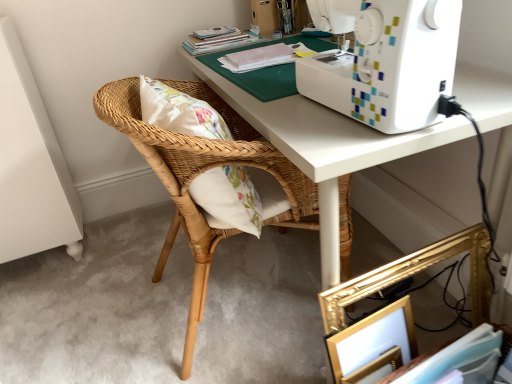
Where is `gold metallic picture frame at lower right`? Image resolution: width=512 pixels, height=384 pixels. gold metallic picture frame at lower right is located at coordinates (415, 273).

Measure the distance between point (247, 66) and camera.

They are 1.33 meters apart.

This screenshot has height=384, width=512. Describe the element at coordinates (259, 57) in the screenshot. I see `matte white book at upper center, which appears as the 2th book when viewed from the front` at that location.

Identify the location of white matte sewing machine at upper right. The height and width of the screenshot is (384, 512). (326, 147).

The image size is (512, 384). What do you see at coordinates (202, 171) in the screenshot?
I see `woven wood chair at center` at bounding box center [202, 171].

Image resolution: width=512 pixels, height=384 pixels. Find the location of `white plastic sewing machine at upper right`. white plastic sewing machine at upper right is located at coordinates (385, 61).

Identify the location of gold metallic picture frame at lower right. (415, 273).

Can you confirm if white paper book at lower right, the 3th book from the back, is positioned to the left of matte white book at upper center, which appears as the 2th book when viewed from the front?

No, white paper book at lower right, the 3th book from the back, is not to the left of matte white book at upper center, which appears as the 2th book when viewed from the front.

Considering the points (379, 382) and (272, 60), which point is in front, point (379, 382) or point (272, 60)?

The point (379, 382) is closer to the camera.

Looking at their sizes, would you say white paper book at lower right, which is the 1th book in bottom-to-top order, is wider or thinner than matte white book at upper center, which appears as the 2th book when viewed from the front?

Considering their sizes, white paper book at lower right, which is the 1th book in bottom-to-top order, looks broader than matte white book at upper center, which appears as the 2th book when viewed from the front.

From the image's perspective, which one is positioned lower, white paper book at lower right, the 3th book from the back, or matte white book at upper center, the 2th book from the top?

white paper book at lower right, the 3th book from the back, from the image's perspective.

Does woven wood chair at center have a greater width compared to white plastic sewing machine at upper right?

Yes, woven wood chair at center is wider than white plastic sewing machine at upper right.

Is woven wood chair at center taller than white plastic sewing machine at upper right?

Indeed, woven wood chair at center has a greater height compared to white plastic sewing machine at upper right.

Is point (226, 111) behind point (337, 63)?

Yes.

Can you tell me how much woven wood chair at center and white plastic sewing machine at upper right differ in facing direction?

Answer: They differ by 167 degrees in their facing directions.

Could gold metallic picture frame at lower right be considered to be inside hardcover book at upper center, which is the third book in bottom-to-top order?

Definitely not — gold metallic picture frame at lower right is not inside hardcover book at upper center, which is the third book in bottom-to-top order.

Is hardcover book at upper center, the first book from the back, far from gold metallic picture frame at lower right?

hardcover book at upper center, the first book from the back, is far away from gold metallic picture frame at lower right.

Can you confirm if hardcover book at upper center, the first book from the back, is positioned to the left of gold metallic picture frame at lower right?

Correct, you'll find hardcover book at upper center, the first book from the back, to the left of gold metallic picture frame at lower right.

Does hardcover book at upper center, the first book from the back, lie in front of white matte sewing machine at upper right?

No, it is behind white matte sewing machine at upper right.

Is point (216, 48) farther from camera compared to point (360, 138)?

Yes, it is.

Is hardcover book at upper center, which is the 3th book from front to back, facing away from white matte sewing machine at upper right?

No, white matte sewing machine at upper right is not at the back of hardcover book at upper center, which is the 3th book from front to back.

Considering the sizes of objects hardcover book at upper center, which is the third book in bottom-to-top order, and white matte sewing machine at upper right in the image provided, who is bigger, hardcover book at upper center, which is the third book in bottom-to-top order, or white matte sewing machine at upper right?

white matte sewing machine at upper right.

Is hardcover book at upper center, the first book in the top-to-bottom sequence, bigger or smaller than woven wood chair at center?

In the image, hardcover book at upper center, the first book in the top-to-bottom sequence, appears to be smaller than woven wood chair at center.

What's the angular difference between hardcover book at upper center, which is the third book in bottom-to-top order, and woven wood chair at center's facing directions?

The angular difference between hardcover book at upper center, which is the third book in bottom-to-top order, and woven wood chair at center is 170 degrees.

Does point (195, 43) lie in front of point (240, 156)?

No.

Are hardcover book at upper center, the first book from the back, and woven wood chair at center located far from each other?

No, hardcover book at upper center, the first book from the back, is not far from woven wood chair at center.

Is the position of matte white book at upper center, which appears as the 2th book when viewed from the front, more distant than that of white matte sewing machine at upper right?

Yes, it is.

What's the angular difference between matte white book at upper center, acting as the second book starting from the back, and white matte sewing machine at upper right's facing directions?

matte white book at upper center, acting as the second book starting from the back, and white matte sewing machine at upper right are facing 0.0353 degrees away from each other.

Is matte white book at upper center, the second book in the right-to-left sequence, situated inside white matte sewing machine at upper right or outside?

The correct answer is: outside.

From the image's perspective, which object appears higher, matte white book at upper center, the second book in the right-to-left sequence, or white matte sewing machine at upper right?

matte white book at upper center, the second book in the right-to-left sequence.

From the picture: Can you confirm if white paper book at lower right, which is the 3th book in left-to-right order, is shorter than hardcover book at upper center, which is the 3th book from front to back?

No.

How far apart are white paper book at lower right, the 1th book viewed from the front, and hardcover book at upper center, which is the third book in bottom-to-top order?

1.21 meters.

From the image's perspective, is white paper book at lower right, which is the 3th book in left-to-right order, located beneath hardcover book at upper center, acting as the third book starting from the right?

Indeed, from the image's perspective, white paper book at lower right, which is the 3th book in left-to-right order, is shown beneath hardcover book at upper center, acting as the third book starting from the right.

Which object is further away from the camera taking this photo, white paper book at lower right, the 1th book viewed from the front, or hardcover book at upper center, marked as the first book in a left-to-right arrangement?

Positioned behind is hardcover book at upper center, marked as the first book in a left-to-right arrangement.

From a real-world perspective, starting from the white paper book at lower right, placed as the third book when sorted from top to bottom, which book is the 1st one vertically above it? Please provide its 2D coordinates.

[(259, 57)]

I want to click on chair located below the white plastic sewing machine at upper right (from the image's perspective), so click(202, 171).

Based on their spatial positions, is woven wood chair at center or gold metallic picture frame at lower right closer to white matte sewing machine at upper right?

woven wood chair at center lies closer to white matte sewing machine at upper right than the other object.

Based on their spatial positions, is matte white book at upper center, which appears as the 2th book when viewed from the front, or white paper book at lower right, the 3th book from the back, closer to white matte sewing machine at upper right?

Among the two, matte white book at upper center, which appears as the 2th book when viewed from the front, is located nearer to white matte sewing machine at upper right.

Based on their spatial positions, is matte white book at upper center, the second book in the right-to-left sequence, or gold metallic picture frame at lower right closer to white plastic sewing machine at upper right?

gold metallic picture frame at lower right.

Which object lies further to the anchor point matte white book at upper center, placed as the second book when sorted from left to right, gold metallic picture frame at lower right or woven wood chair at center?

Based on the image, gold metallic picture frame at lower right appears to be further to matte white book at upper center, placed as the second book when sorted from left to right.

Considering their positions, is gold metallic picture frame at lower right positioned further to hardcover book at upper center, the first book in the top-to-bottom sequence, than woven wood chair at center?

gold metallic picture frame at lower right is further to hardcover book at upper center, the first book in the top-to-bottom sequence.

When comparing their distances from woven wood chair at center, does gold metallic picture frame at lower right or white plastic sewing machine at upper right seem closer?

Based on the image, white plastic sewing machine at upper right appears to be nearer to woven wood chair at center.

Based on their spatial positions, is hardcover book at upper center, the first book from the back, or gold metallic picture frame at lower right further from white paper book at lower right, positioned as the first book in right-to-left order?

hardcover book at upper center, the first book from the back, lies further to white paper book at lower right, positioned as the first book in right-to-left order, than the other object.

Looking at this image, looking at the image, which one is located further to woven wood chair at center, white plastic sewing machine at upper right or gold metallic picture frame at lower right?

gold metallic picture frame at lower right lies further to woven wood chair at center than the other object.

The width and height of the screenshot is (512, 384). I want to click on picture frame between woven wood chair at center and white paper book at lower right, which is the 1th book in bottom-to-top order, from left to right, so click(415, 273).

This screenshot has width=512, height=384. Find the location of `chair between white matte sewing machine at upper right and hardcover book at upper center, the first book from the back, along the z-axis`. chair between white matte sewing machine at upper right and hardcover book at upper center, the first book from the back, along the z-axis is located at coordinates (202, 171).

Identify the location of book between hardcover book at upper center, which is the third book in bottom-to-top order, and white paper book at lower right, which is the 1th book in bottom-to-top order, vertically. click(259, 57).

In order to click on chair located between white matte sewing machine at upper right and matte white book at upper center, the second book in the right-to-left sequence, in the depth direction in this screenshot , I will do `click(202, 171)`.